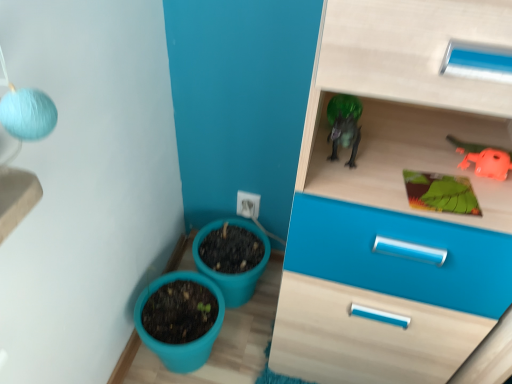
Question: Does green matte board at upper right have a smaller size compared to matte plastic flowerpot at lower center, the second flowerpot in the front-to-back sequence?

Choices:
 (A) yes
 (B) no

Answer: (A)

Question: From the image's perspective, is green matte board at upper right located above matte plastic flowerpot at lower center, the second flowerpot in the front-to-back sequence?

Choices:
 (A) no
 (B) yes

Answer: (B)

Question: Is green matte board at upper right at the left side of matte plastic flowerpot at lower center, the second flowerpot in the front-to-back sequence?

Choices:
 (A) no
 (B) yes

Answer: (A)

Question: From the image's perspective, is green matte board at upper right beneath matte plastic flowerpot at lower center, which appears as the 1th flowerpot when viewed from the back?

Choices:
 (A) yes
 (B) no

Answer: (B)

Question: From a real-world perspective, is green matte board at upper right located beneath matte plastic flowerpot at lower center, the second flowerpot in the front-to-back sequence?

Choices:
 (A) no
 (B) yes

Answer: (A)

Question: Is point (451, 190) closer or farther from the camera than point (217, 319)?

Choices:
 (A) farther
 (B) closer

Answer: (B)

Question: In terms of width, does green matte board at upper right look wider or thinner when compared to teal plastic flowerpot at lower left, marked as the 2th flowerpot in a back-to-front arrangement?

Choices:
 (A) thin
 (B) wide

Answer: (A)

Question: Considering the positions of green matte board at upper right and teal plastic flowerpot at lower left, marked as the 2th flowerpot in a back-to-front arrangement, in the image, is green matte board at upper right taller or shorter than teal plastic flowerpot at lower left, marked as the 2th flowerpot in a back-to-front arrangement,?

Choices:
 (A) tall
 (B) short

Answer: (B)

Question: In terms of size, does green matte board at upper right appear bigger or smaller than teal plastic flowerpot at lower left, which is the first flowerpot in front-to-back order?

Choices:
 (A) big
 (B) small

Answer: (B)

Question: Visually, is orange rubber toy at upper right positioned to the left or to the right of matte plastic flowerpot at lower center, the second flowerpot in the front-to-back sequence?

Choices:
 (A) right
 (B) left

Answer: (A)

Question: Is point (497, 157) positioned closer to the camera than point (215, 279)?

Choices:
 (A) closer
 (B) farther

Answer: (A)

Question: Which is correct: orange rubber toy at upper right is inside matte plastic flowerpot at lower center, which appears as the 1th flowerpot when viewed from the back, or outside of it?

Choices:
 (A) outside
 (B) inside

Answer: (A)

Question: Considering the positions of orange rubber toy at upper right and matte plastic flowerpot at lower center, the second flowerpot in the front-to-back sequence, in the image, is orange rubber toy at upper right wider or thinner than matte plastic flowerpot at lower center, the second flowerpot in the front-to-back sequence,?

Choices:
 (A) thin
 (B) wide

Answer: (A)

Question: Looking at their shapes, would you say teal plastic flowerpot at lower left, marked as the 2th flowerpot in a back-to-front arrangement, is wider or thinner than orange rubber toy at upper right?

Choices:
 (A) wide
 (B) thin

Answer: (A)

Question: From the image's perspective, is teal plastic flowerpot at lower left, marked as the 2th flowerpot in a back-to-front arrangement, positioned above or below orange rubber toy at upper right?

Choices:
 (A) below
 (B) above

Answer: (A)